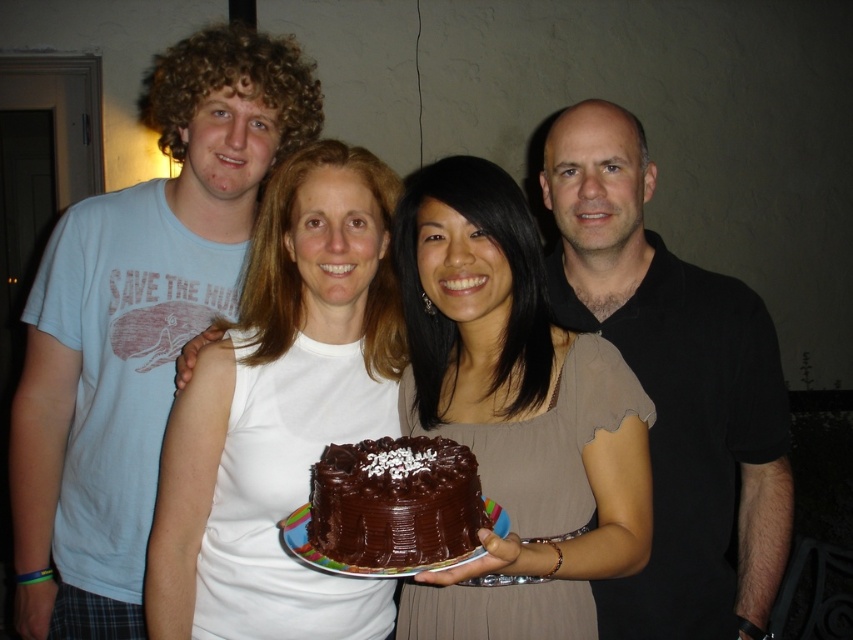
You are planning to take a photo of the black matte shirt at right and the chocolatesmoothcake at center. Which object should you focus on if you want to capture both in the frame without cropping either?

The black matte shirt at right is bigger than chocolatesmoothcake at center, so you should focus on the black matte shirt at right to ensure both objects fit in the frame without cropping.

You are a photographer standing at the doorway on the left. You want to take a picture of the smooth chocolate cake at center. Which direction should you move to get a clear shot of the cake?

The smooth chocolate cake at center is located at point (515, 410), so you should move forward towards the center of the room to get a clear shot of the smooth chocolate cake at center.